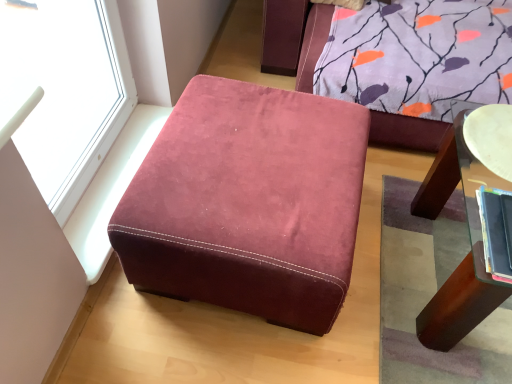
Identify the location of free space above suede-like burgundy ottoman at center (from a real-world perspective). click(x=252, y=155).